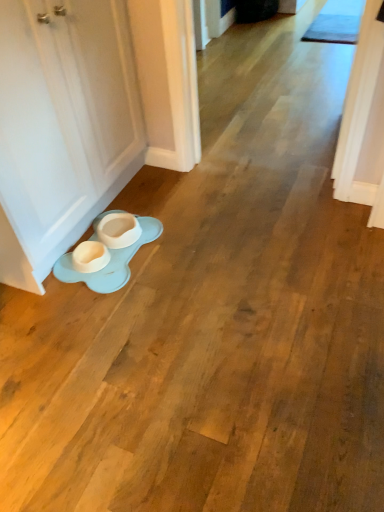
Find the location of `vacant space that is in between white matte door at lower left and light blue rubber saucer at lower left`. vacant space that is in between white matte door at lower left and light blue rubber saucer at lower left is located at coordinates click(136, 212).